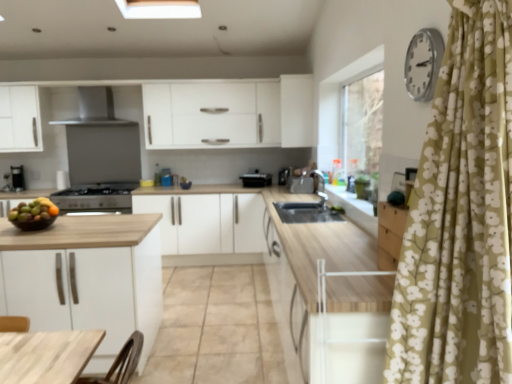
Question: Considering the positions of point (429, 81) and point (211, 210), is point (429, 81) closer or farther from the camera than point (211, 210)?

Choices:
 (A) closer
 (B) farther

Answer: (A)

Question: From the image's perspective, is silver metallic clock at upper right located above or below white matte cabinet at center, the first cabinetry when ordered from left to right?

Choices:
 (A) below
 (B) above

Answer: (B)

Question: Which of these objects is positioned farthest from the white matte cabinet at center, which is the 1th cabinetry in bottom-to-top order?

Choices:
 (A) white matte cabinet at upper center, acting as the 2th cabinetry starting from the left
 (B) glossy wooden bowl of mixed fruits at left
 (C) stainless steel range hood at upper center
 (D) black matte gas stove at center-left, the third appliance viewed from the right
 (E) silver metallic clock at upper right

Answer: (E)

Question: Considering the real-world distances, which object is closest to the white matte cabinet at upper center, the first cabinetry positioned from the top?

Choices:
 (A) white matte cabinet at center, which appears as the second cabinetry when viewed from the right
 (B) wooden bowl at left
 (C) stainless steel range hood at upper center
 (D) wooden countertop at center
 (E) black matte gas stove at center-left, the third appliance viewed from the right

Answer: (A)